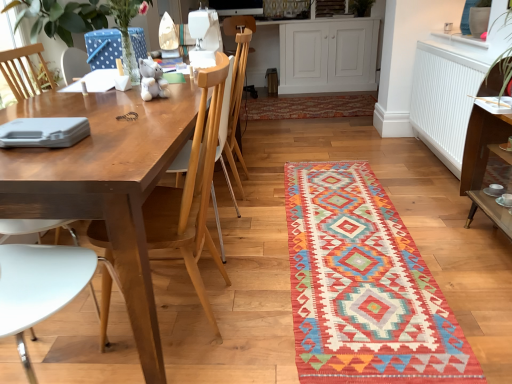
Where is `unoccupied region to the right of wooden chair at left`? The width and height of the screenshot is (512, 384). unoccupied region to the right of wooden chair at left is located at coordinates (270, 304).